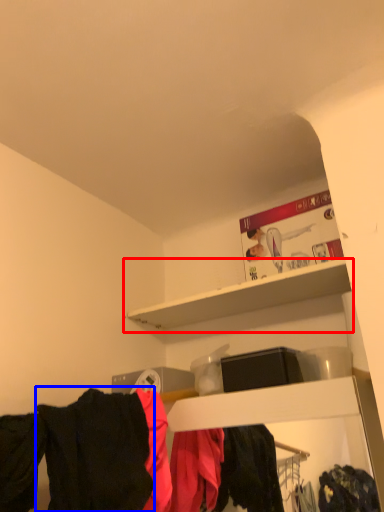
Question: Among these objects, which one is nearest to the camera, shelf (highlighted by a red box) or clothing (highlighted by a blue box)?

Choices:
 (A) shelf
 (B) clothing

Answer: (B)